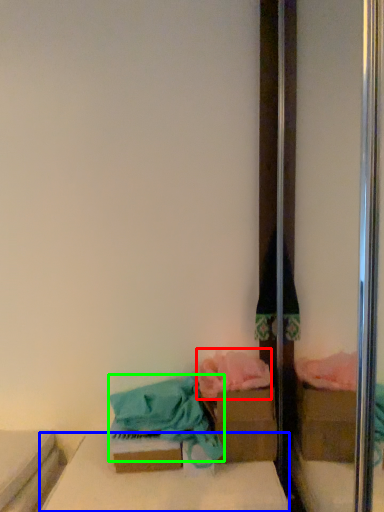
Question: Which is nearer to the material (highlighted by a red box)? furniture (highlighted by a blue box) or material (highlighted by a green box).

Choices:
 (A) furniture
 (B) material

Answer: (B)